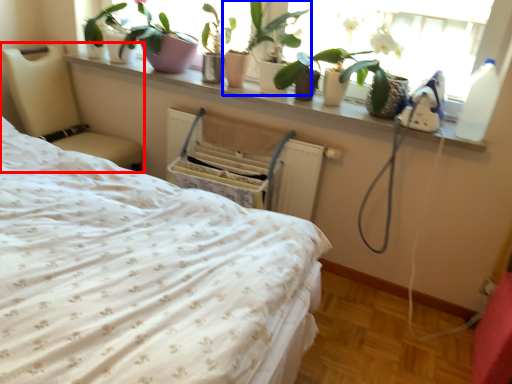
Question: Which point is closer to the camera, furniture (highlighted by a red box) or houseplant (highlighted by a blue box)?

Choices:
 (A) furniture
 (B) houseplant

Answer: (B)